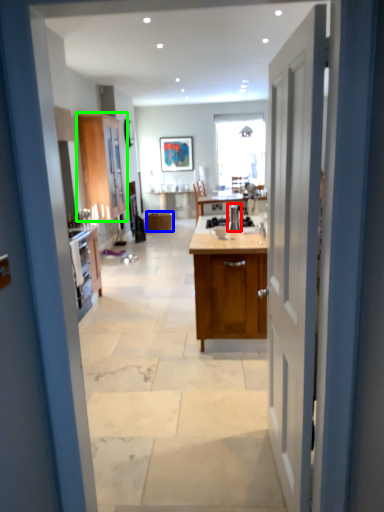
Question: Which is nearer to the appliance (highlighted by a red box)? cabinetry (highlighted by a blue box) or cabinetry (highlighted by a green box).

Choices:
 (A) cabinetry
 (B) cabinetry

Answer: (B)